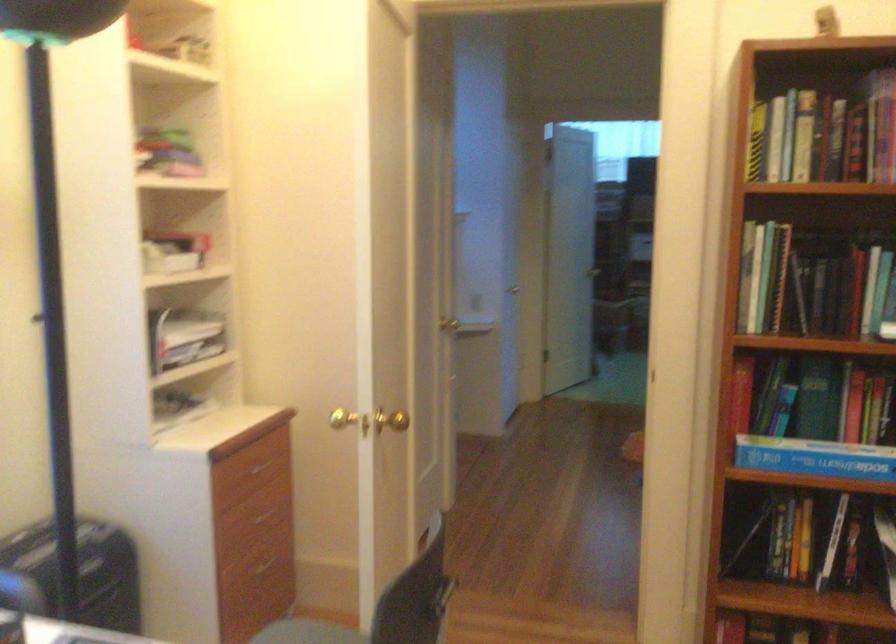
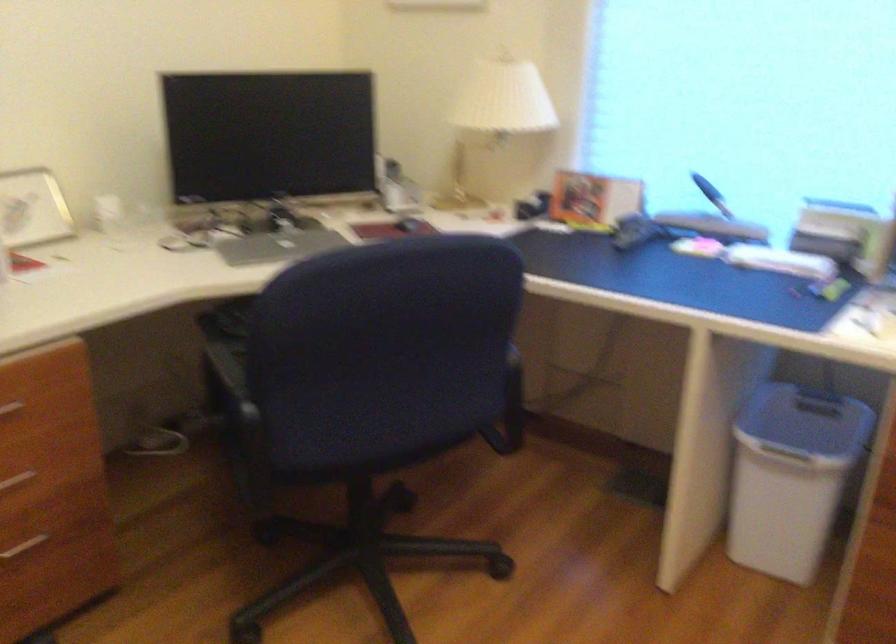
How did the camera likely rotate?

The camera rotated toward left-down.